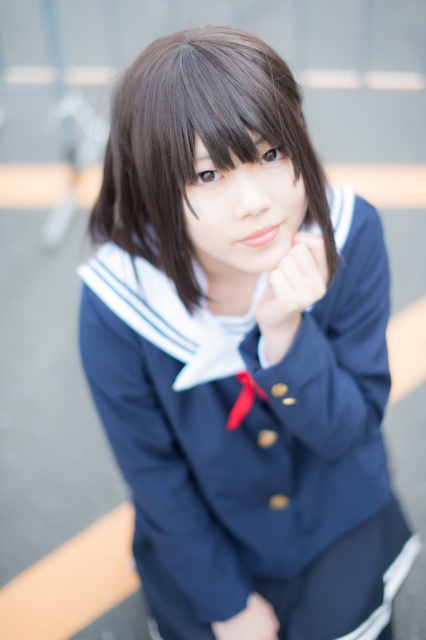
Which of these two, semi-glossy dark brown hair at center or matte skin hand at center, stands taller?

Standing taller between the two is semi-glossy dark brown hair at center.

Can you confirm if semi-glossy dark brown hair at center is taller than matte skin hand at center?

Yes.

Does point (224, 125) come closer to viewer compared to point (256, 321)?

Yes, point (224, 125) is in front of point (256, 321).

This screenshot has height=640, width=426. In order to click on semi-glossy dark brown hair at center in this screenshot , I will do `click(193, 141)`.

Is point (184, 148) behind point (267, 637)?

No, it is not.

Who is shorter, semi-glossy dark brown hair at center or matte skin hand at lower center?

Standing shorter between the two is matte skin hand at lower center.

In order to click on semi-glossy dark brown hair at center in this screenshot , I will do `click(193, 141)`.

The width and height of the screenshot is (426, 640). Identify the location of semi-glossy dark brown hair at center. (193, 141).

Is matte skin hand at center below matte skin hand at lower center?

No.

Is matte skin hand at center in front of matte skin hand at lower center?

Yes, it is.

This screenshot has width=426, height=640. Identify the location of matte skin hand at center. (291, 291).